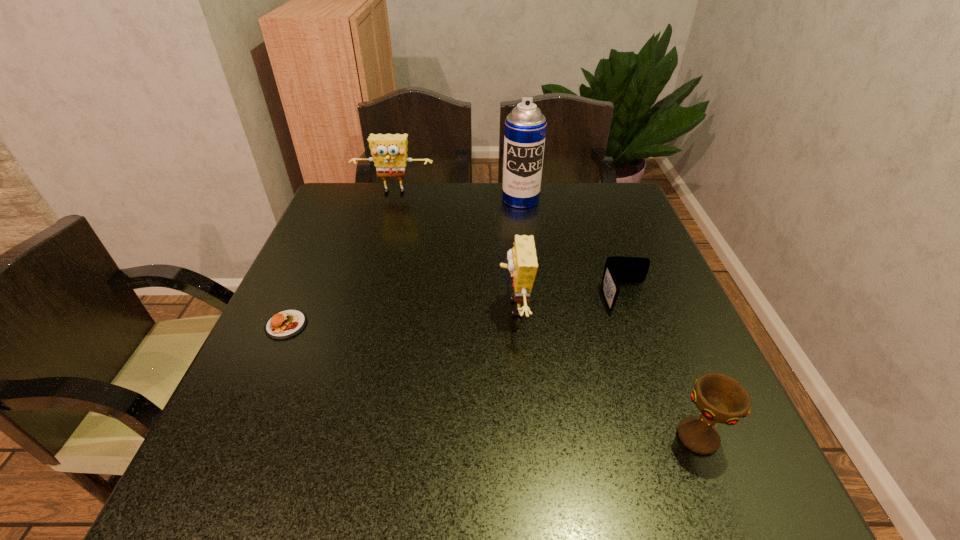
At what (x,y) coordinates should I click in order to perform the action: click on vacant region located on the face of the right sponge. Please return your answer as a coordinate pair (x, y). Looking at the image, I should click on pyautogui.click(x=392, y=308).

Where is `vacant space located 0.130m on the face of the right sponge`? This screenshot has width=960, height=540. vacant space located 0.130m on the face of the right sponge is located at coordinates (441, 308).

At what (x,y) coordinates should I click in order to perform the action: click on blank area located 0.170m on the back of the nearest object. Please return your answer as a coordinate pair (x, y). Looking at the image, I should click on (660, 342).

You are a GUI agent. You are given a task and a screenshot of the screen. Output one action in this format:
    pyautogui.click(x=<x>, y=<y>)
    Task: Click on the vacant space positioned 0.360m on the outer surface of the wallet
    The height and width of the screenshot is (540, 960).
    Given the screenshot: What is the action you would take?
    pyautogui.click(x=690, y=475)

The height and width of the screenshot is (540, 960). What are the coordinates of `free region located on the right of the patty (food)` in the screenshot? It's located at (454, 325).

Image resolution: width=960 pixels, height=540 pixels. Identify the location of aerosol can that is at the far edge. (525, 127).

Locate an element on the screen. This screenshot has width=960, height=540. sponge at the far edge is located at coordinates (389, 151).

Image resolution: width=960 pixels, height=540 pixels. I want to click on object located in the near edge section of the desktop, so click(x=721, y=399).

Locate an element on the screen. sponge that is at the left edge is located at coordinates pyautogui.click(x=389, y=151).

This screenshot has width=960, height=540. I want to click on patty (food) located in the left edge section of the desktop, so click(x=284, y=324).